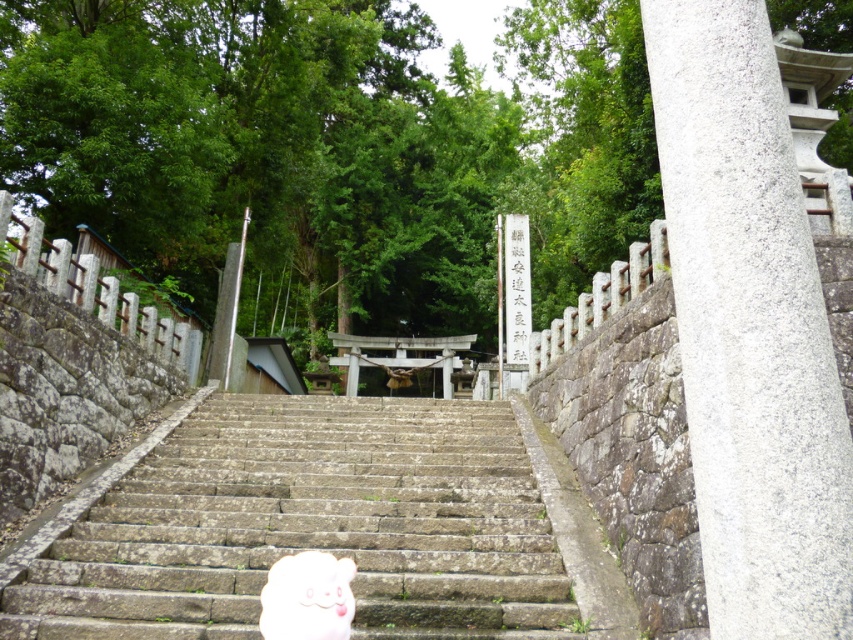
You are visiting a traditional Japanese shrine and see the stone stairs at center and a white plush toy at center. Which object is closer to you as you face the shrine entrance?

The stone stairs at center are closer to you than the white plush toy at center because the white plush toy at center is positioned behind the stone stairs at center.